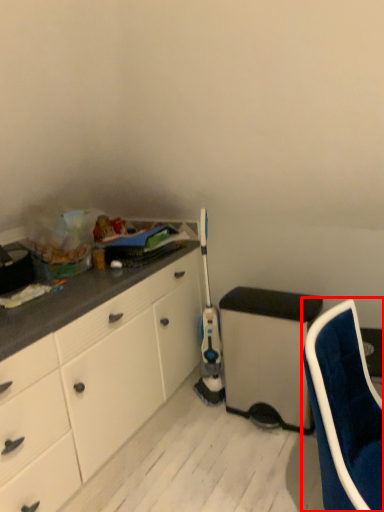
Question: From the image's perspective, where is chair (annotated by the red box) located relative to appliance?

Choices:
 (A) below
 (B) above

Answer: (A)